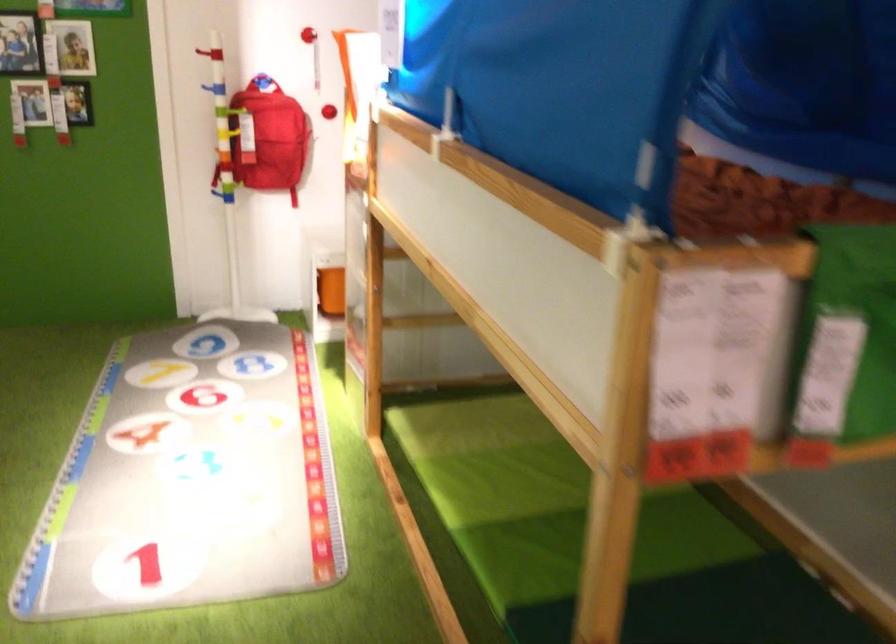
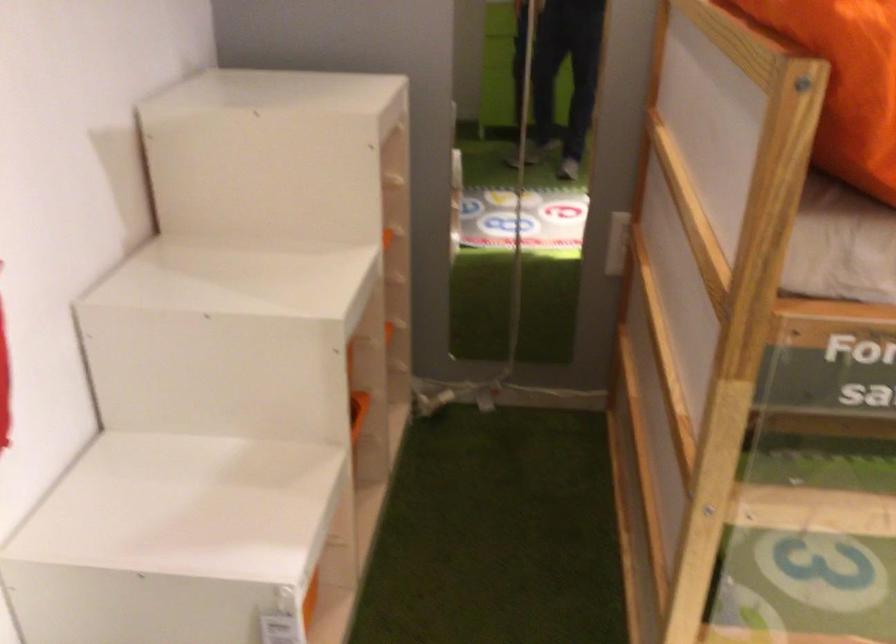
Where in the second image is the point corresponding to (x=339, y=304) from the first image?

(309, 600)